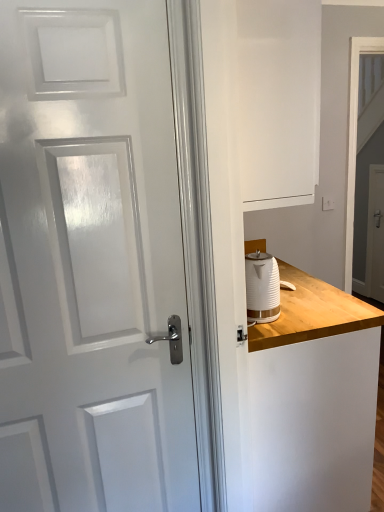
Question: Is white ribbed kettle at right not within white matte dresser at right?

Choices:
 (A) yes
 (B) no

Answer: (A)

Question: Considering the relative sizes of white ribbed kettle at right and white matte dresser at right in the image provided, is white ribbed kettle at right taller than white matte dresser at right?

Choices:
 (A) yes
 (B) no

Answer: (B)

Question: Is white ribbed kettle at right at the left side of white matte dresser at right?

Choices:
 (A) no
 (B) yes

Answer: (A)

Question: Is white ribbed kettle at right in contact with white matte dresser at right?

Choices:
 (A) no
 (B) yes

Answer: (A)

Question: Is the depth of white ribbed kettle at right greater than that of white matte dresser at right?

Choices:
 (A) no
 (B) yes

Answer: (B)

Question: In the image, is white glossy screen door at upper right, which is counted as the 1th screen door, starting from the left, on the left side or the right side of white ribbed kettle at right?

Choices:
 (A) left
 (B) right

Answer: (B)

Question: Is white glossy screen door at upper right, the second screen door positioned from the back, situated inside white ribbed kettle at right or outside?

Choices:
 (A) inside
 (B) outside

Answer: (B)

Question: In the image, is white glossy screen door at upper right, the second screen door positioned from the back, positioned in front of or behind white ribbed kettle at right?

Choices:
 (A) behind
 (B) front

Answer: (A)

Question: In terms of height, does white glossy screen door at upper right, the second screen door positioned from the back, look taller or shorter compared to white ribbed kettle at right?

Choices:
 (A) tall
 (B) short

Answer: (A)

Question: Is white glossy screen door at right, the second screen door viewed from the left, wider or thinner than white matte dresser at right?

Choices:
 (A) thin
 (B) wide

Answer: (A)

Question: From their relative heights in the image, would you say white glossy screen door at right, acting as the first screen door starting from the back, is taller or shorter than white matte dresser at right?

Choices:
 (A) tall
 (B) short

Answer: (B)

Question: Considering their positions, is white glossy screen door at right, which appears as the 2th screen door when viewed from the front, located in front of or behind white matte dresser at right?

Choices:
 (A) behind
 (B) front

Answer: (A)

Question: In terms of size, does white glossy screen door at right, acting as the first screen door starting from the back, appear bigger or smaller than white matte dresser at right?

Choices:
 (A) small
 (B) big

Answer: (A)

Question: From a real-world perspective, is white glossy door at left above or below white matte dresser at right?

Choices:
 (A) below
 (B) above

Answer: (A)

Question: From the image's perspective, is white glossy door at left positioned above or below white matte dresser at right?

Choices:
 (A) above
 (B) below

Answer: (A)